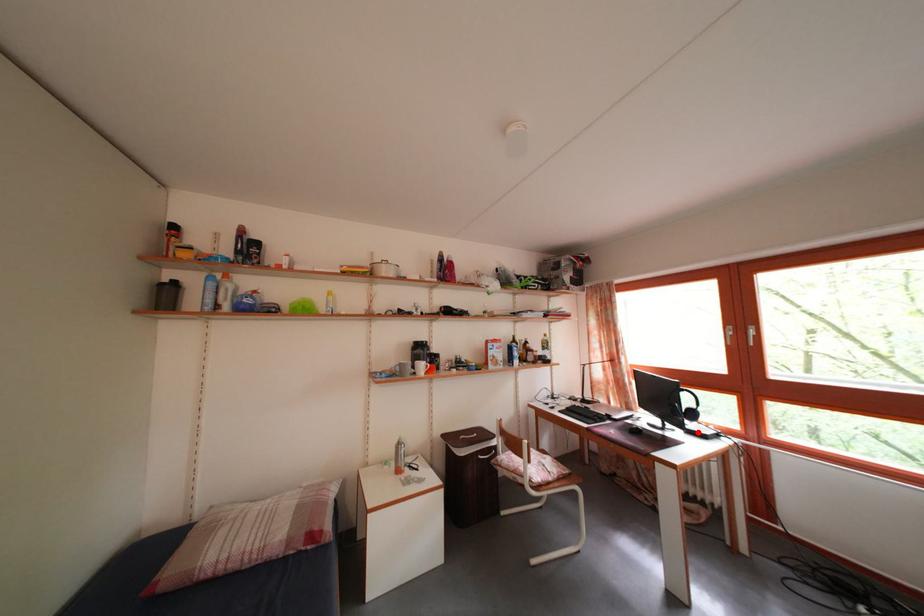
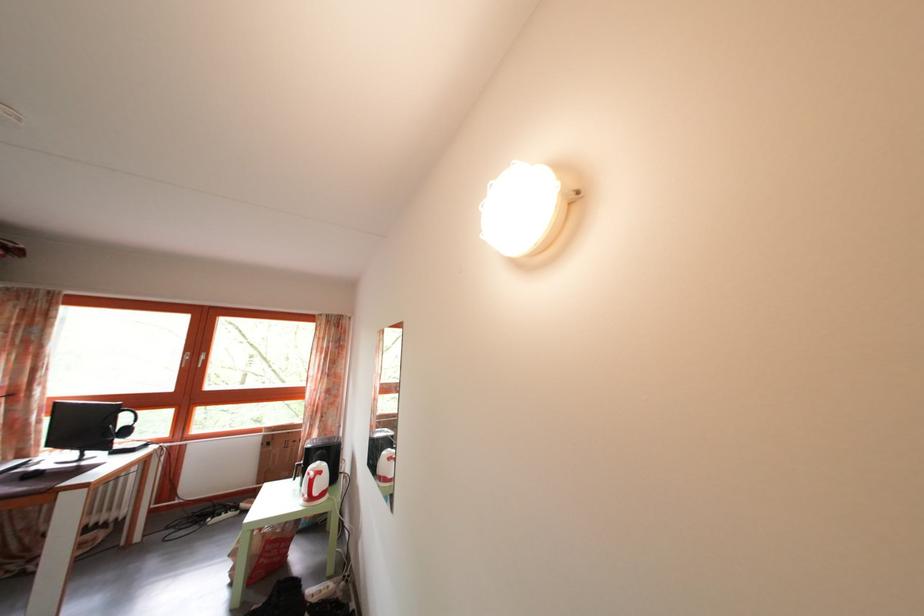
Locate, in the second image, the point that corresponds to the highlighted location in the first image.

(128, 451)